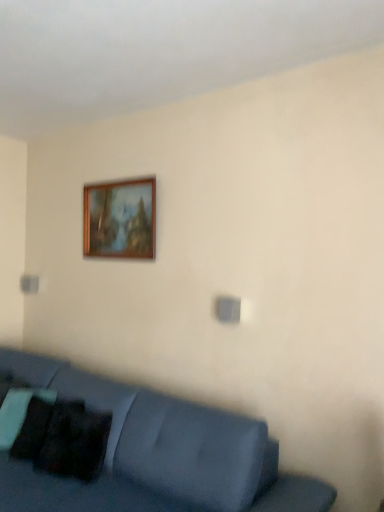
Question: In the image, is wooden picture frame at upper center positioned in front of or behind black matte pillow at lower left?

Choices:
 (A) front
 (B) behind

Answer: (B)

Question: From a real-world perspective, is wooden picture frame at upper center positioned above or below black matte pillow at lower left?

Choices:
 (A) above
 (B) below

Answer: (A)

Question: Considering the real-world distances, which object is closest to the wooden picture frame at upper center?

Choices:
 (A) matte blue couch at lower left
 (B) black matte pillow at lower left

Answer: (A)

Question: Which of these objects is positioned closest to the black matte pillow at lower left?

Choices:
 (A) wooden picture frame at upper center
 (B) matte blue couch at lower left

Answer: (B)